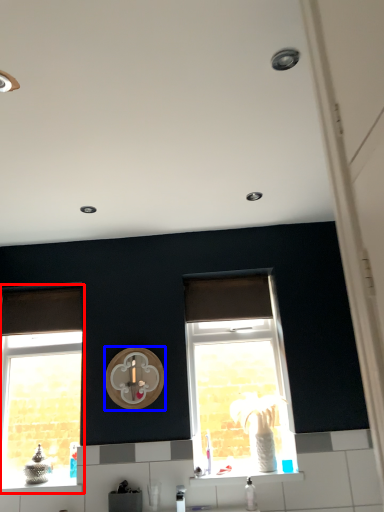
Question: Which point is closer to the camera, window (highlighted by a red box) or clock (highlighted by a blue box)?

Choices:
 (A) window
 (B) clock

Answer: (B)